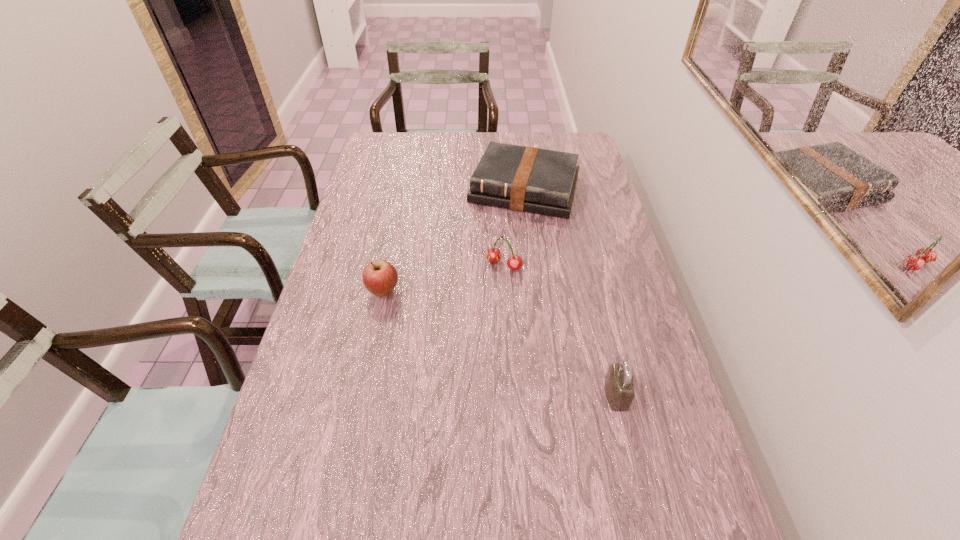
This screenshot has height=540, width=960. I want to click on vacant space that satisfies the following two spatial constraints: 1. on the front side of the second nearest object; 2. at the front of the nearest object near the keyhole, so (362, 395).

Image resolution: width=960 pixels, height=540 pixels. Identify the location of blank space that satisfies the following two spatial constraints: 1. on the front side of the farthest object; 2. at the front of the padlock near the keyhole. (549, 395).

Locate an element on the screen. The width and height of the screenshot is (960, 540). vacant space that satisfies the following two spatial constraints: 1. on the front side of the padlock; 2. at the front of the second farthest object near the keyhole is located at coordinates (511, 395).